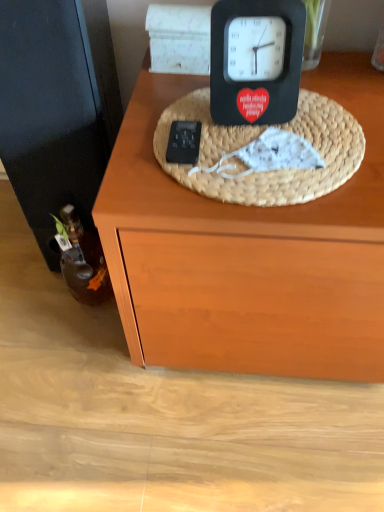
Identify the location of free space in front of black matte clock at upper center. (259, 163).